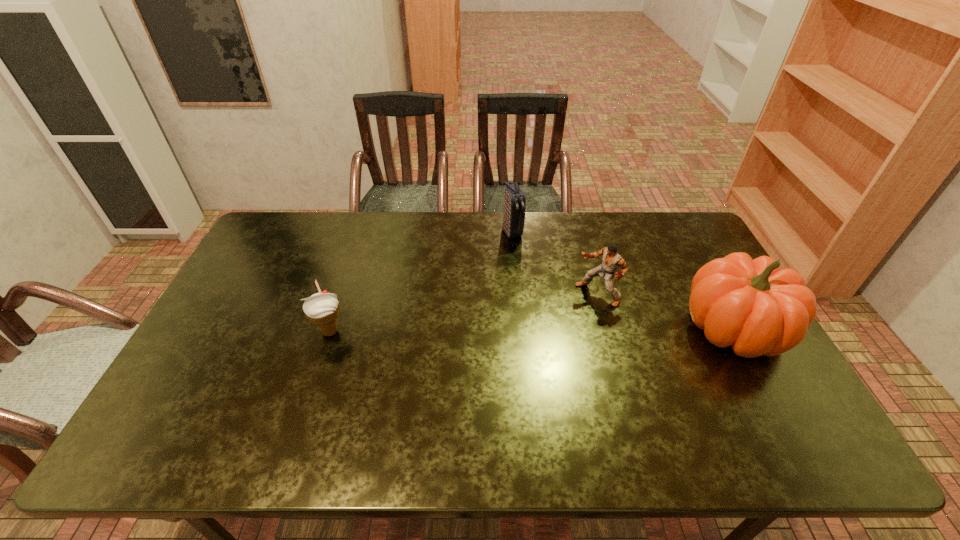
Find the location of a particular element. The image size is (960, 540). vacant space on the desktop that is between the icecream and the rightmost object and is positioned with the zip open on the second object from left to right is located at coordinates (575, 329).

This screenshot has width=960, height=540. I want to click on free space on the desktop that is between the leftmost object and the rightmost object and is positioned on the front-facing side of the puncher, so click(x=541, y=329).